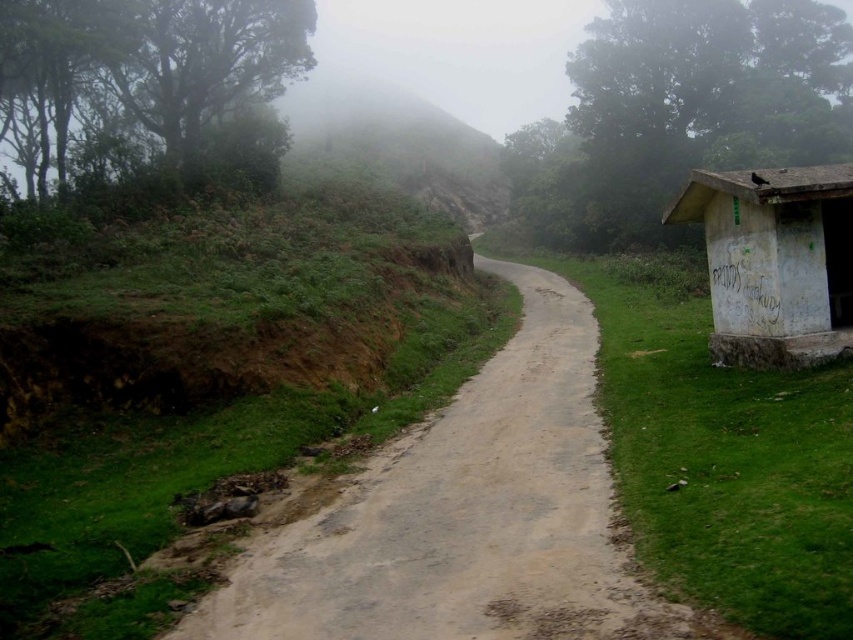
From the picture: You are a hiker planning to climb the hillside. You see the dull gray concrete path at center and the white concrete hut at right. Which object is lower in elevation?

The dull gray concrete path at center is lower in elevation compared to the white concrete hut at right because the path has a lesser height.

You are a hiker carrying a heavy backpack and need to choose between walking on the dull gray concrete path at center or the white concrete hut at right. Which surface is more suitable for your heavy load?

The dull gray concrete path at center has a larger size compared to the white concrete hut at right, so it is more suitable for carrying a heavy load as it can support the weight better.